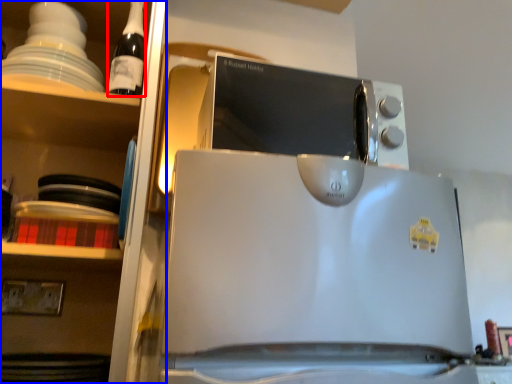
Question: Which of the following is the farthest to the observer, bottle (highlighted by a red box) or shelf (highlighted by a blue box)?

Choices:
 (A) bottle
 (B) shelf

Answer: (A)